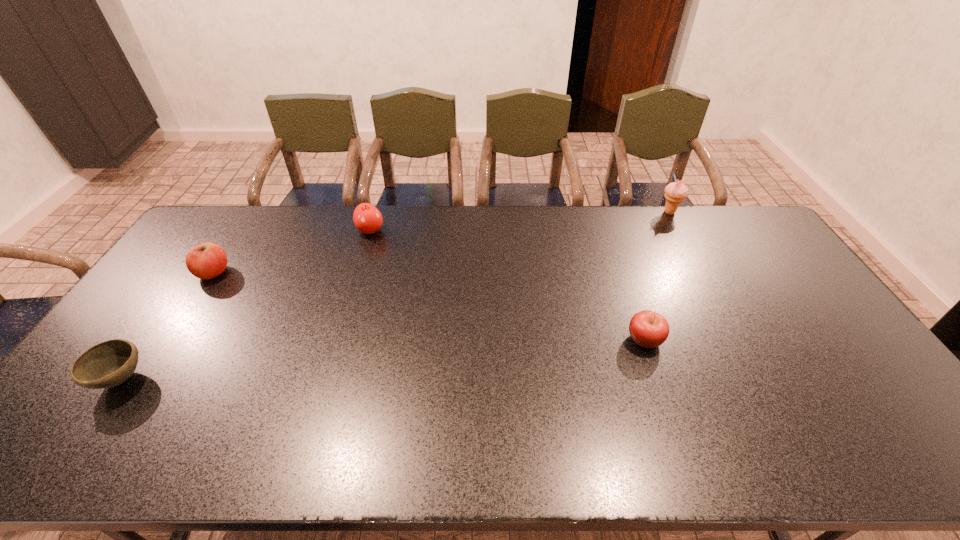
Locate an element on the screen. The height and width of the screenshot is (540, 960). free point at the near edge is located at coordinates (245, 451).

In the image, there is a desktop. At what (x,y) coordinates should I click in order to perform the action: click on free region at the left edge. Please return your answer as a coordinate pair (x, y). Looking at the image, I should click on (75, 405).

The image size is (960, 540). What are the coordinates of `vacant space at the right edge of the desktop` in the screenshot? It's located at click(x=784, y=264).

At what (x,y) coordinates should I click in order to perform the action: click on free space between the farthest object and the leftmost apple. Please return your answer as a coordinate pair (x, y). Image resolution: width=960 pixels, height=540 pixels. Looking at the image, I should click on (442, 242).

Locate an element on the screen. The image size is (960, 540). free point between the nearest object and the fourth nearest object is located at coordinates (246, 305).

Locate an element on the screen. This screenshot has width=960, height=540. vacant space that's between the nearest apple and the second farthest object is located at coordinates click(x=508, y=285).

At what (x,y) coordinates should I click in order to perform the action: click on free space between the third object from right to left and the icecream. Please return your answer as a coordinate pair (x, y). Image resolution: width=960 pixels, height=540 pixels. Looking at the image, I should click on (520, 221).

Where is `free space between the farthest object and the second nearest apple`? The image size is (960, 540). free space between the farthest object and the second nearest apple is located at coordinates (442, 242).

The height and width of the screenshot is (540, 960). I want to click on free space that is in between the second farthest apple and the rightmost object, so click(x=442, y=242).

Where is `free space between the fourth object from left to right and the third farthest object`? free space between the fourth object from left to right and the third farthest object is located at coordinates (429, 306).